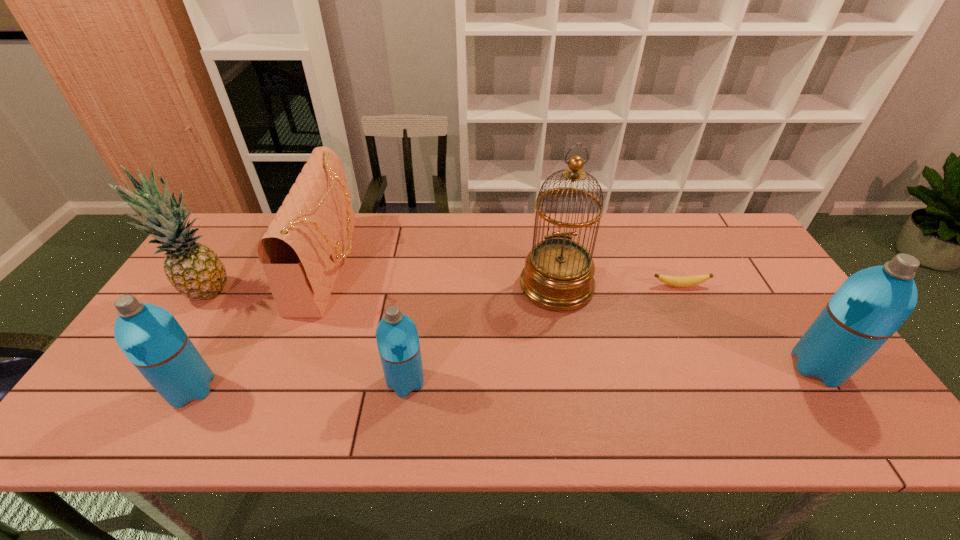
Identify the location of object at the near left corner. The height and width of the screenshot is (540, 960). (151, 338).

Where is `object positioned at the near right corner`? object positioned at the near right corner is located at coordinates (870, 306).

Identify the location of vacant space at the far edge of the desktop. (498, 229).

This screenshot has height=540, width=960. What are the coordinates of `vacant space at the near edge of the desktop` in the screenshot? It's located at (216, 380).

Find the location of a particular element. This screenshot has width=960, height=540. vacant space at the right edge of the desktop is located at coordinates (767, 281).

Identify the location of free location at the far left corner of the desktop. This screenshot has height=540, width=960. click(252, 258).

At what (x,y) coordinates should I click in order to perform the action: click on blank space at the far right corner. Please return your answer as a coordinate pair (x, y). Looking at the image, I should click on (719, 230).

At what (x,y) coordinates should I click in order to perform the action: click on free spot between the banana and the second shortest thermos bottle. Please return your answer as a coordinate pair (x, y). This screenshot has height=540, width=960. Looking at the image, I should click on (435, 338).

Identify the location of vacant area that lies between the birdcage and the third object from left to right. click(x=444, y=275).

This screenshot has height=540, width=960. I want to click on empty space that is in between the rightmost thermos bottle and the fourth object from right to left, so click(x=612, y=374).